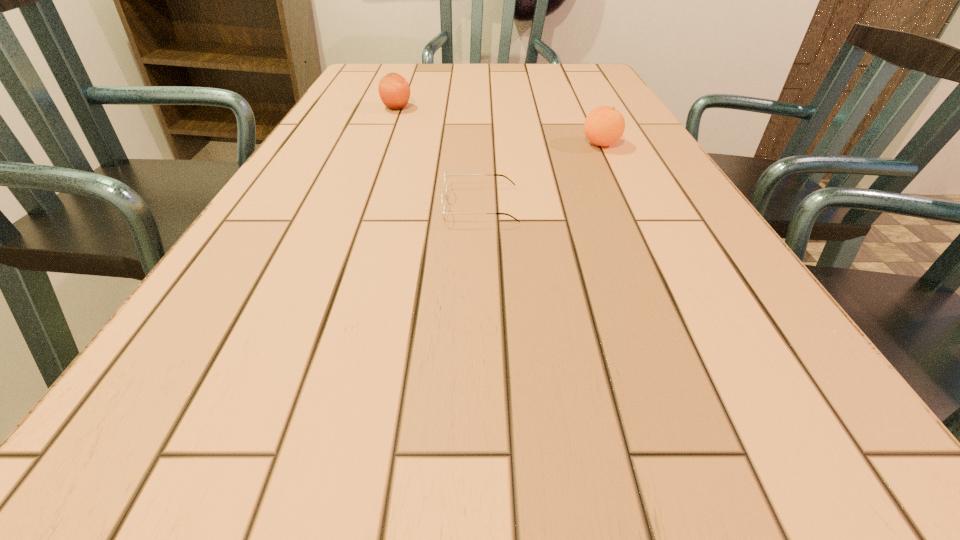
Locate an element on the screen. Image resolution: width=960 pixels, height=540 pixels. free spot between the second farthest object and the farther orange is located at coordinates (499, 126).

You are a GUI agent. You are given a task and a screenshot of the screen. Output one action in this format:
    pyautogui.click(x=<x>, y=<y>)
    Task: Click on the free spot between the shortest object and the second nearest object
    This screenshot has height=540, width=960.
    Given the screenshot: What is the action you would take?
    pyautogui.click(x=540, y=175)

I want to click on free space that is in between the farther orange and the right orange, so click(x=499, y=126).

This screenshot has width=960, height=540. Find the location of `vacant space that is in between the second farthest object and the left orange`. vacant space that is in between the second farthest object and the left orange is located at coordinates (499, 126).

Locate an element on the screen. free space between the second nearest object and the nearest object is located at coordinates (540, 175).

Find the location of a particular element. unoccupied area between the second nearest object and the shortest object is located at coordinates (540, 175).

Locate an element on the screen. The height and width of the screenshot is (540, 960). vacant point located between the leftmost object and the spectacles is located at coordinates (439, 157).

You are a GUI agent. You are given a task and a screenshot of the screen. Output one action in this format:
    pyautogui.click(x=<x>, y=<y>)
    Task: Click on the free space between the farther orange and the rightmost object
    The image size is (960, 540).
    Given the screenshot: What is the action you would take?
    coord(499,126)

The height and width of the screenshot is (540, 960). What are the coordinates of `object that is the second nearest to the spectacles` in the screenshot? It's located at (394, 90).

Identify which object is the nearest to the nearer orange. Please provide its 2D coordinates. Your answer should be formatted as a tuple, i.e. [(x, y)], where the tuple contains the x and y coordinates of a point satisfying the conditions above.

[(446, 175)]